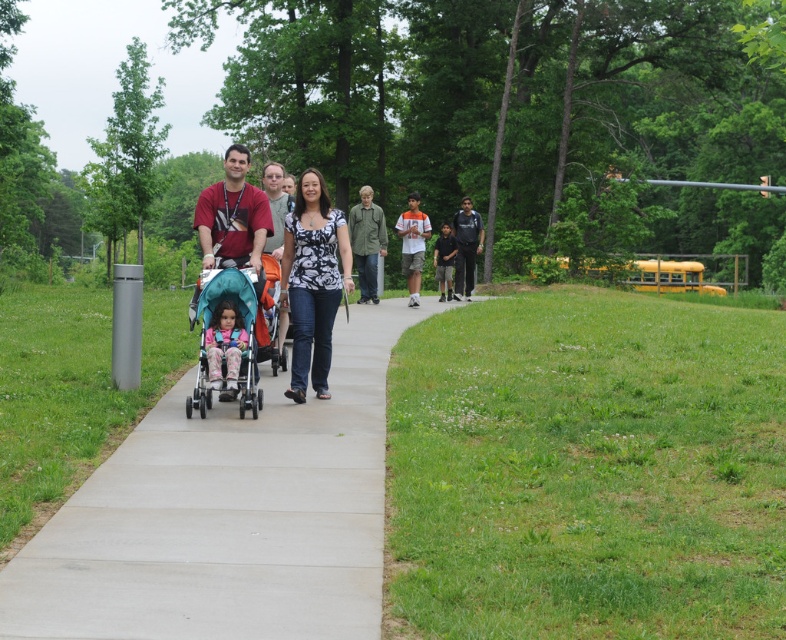
Does concrete at center appear under black and white printed blouse at center?

Yes.

Between concrete at center and black and white printed blouse at center, which one has less height?

concrete at center is shorter.

What do you see at coordinates (228, 515) in the screenshot? Image resolution: width=786 pixels, height=640 pixels. I see `concrete at center` at bounding box center [228, 515].

Find the location of a particular element. concrete at center is located at coordinates (228, 515).

Who is positioned more to the left, matte teal stroller at center or black cotton shirt at center?

From the viewer's perspective, matte teal stroller at center appears more on the left side.

Can you confirm if matte teal stroller at center is taller than black cotton shirt at center?

Indeed, matte teal stroller at center has a greater height compared to black cotton shirt at center.

This screenshot has width=786, height=640. I want to click on matte teal stroller at center, so click(313, 280).

Between matte red shirt at center and matte pink stroller at center, which one has less height?

matte pink stroller at center

Does matte red shirt at center have a smaller size compared to matte pink stroller at center?

No, matte red shirt at center is not smaller than matte pink stroller at center.

Where is `matte red shirt at center`? matte red shirt at center is located at coordinates pyautogui.click(x=232, y=212).